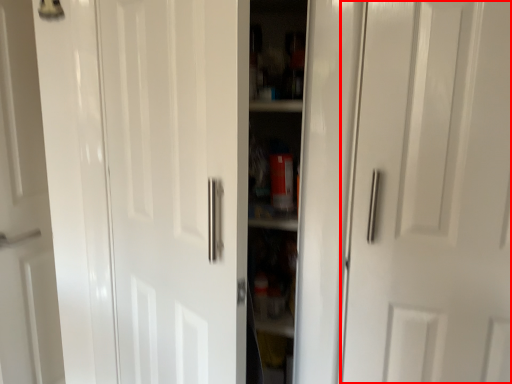
Question: Where is door (annotated by the red box) located in relation to door in the image?

Choices:
 (A) right
 (B) left

Answer: (A)